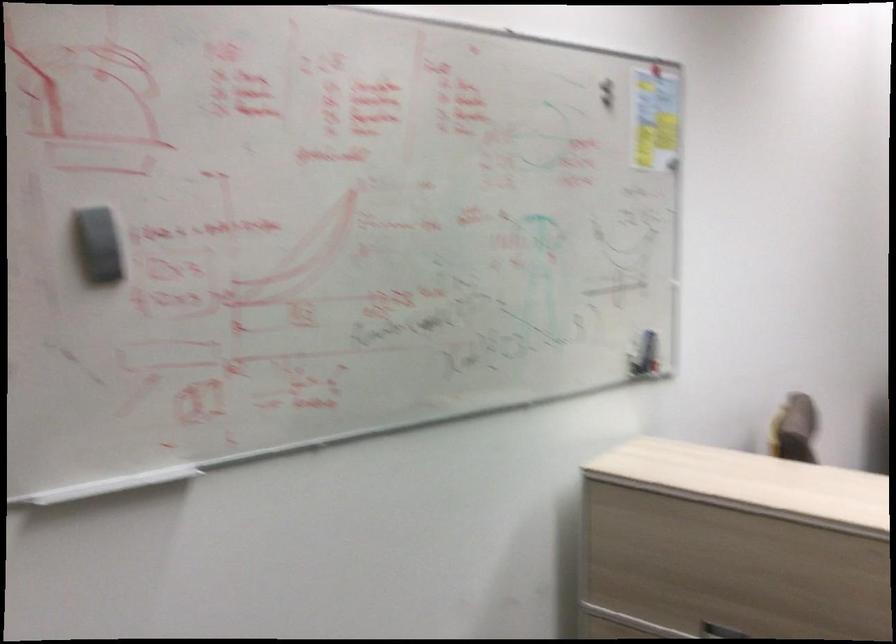
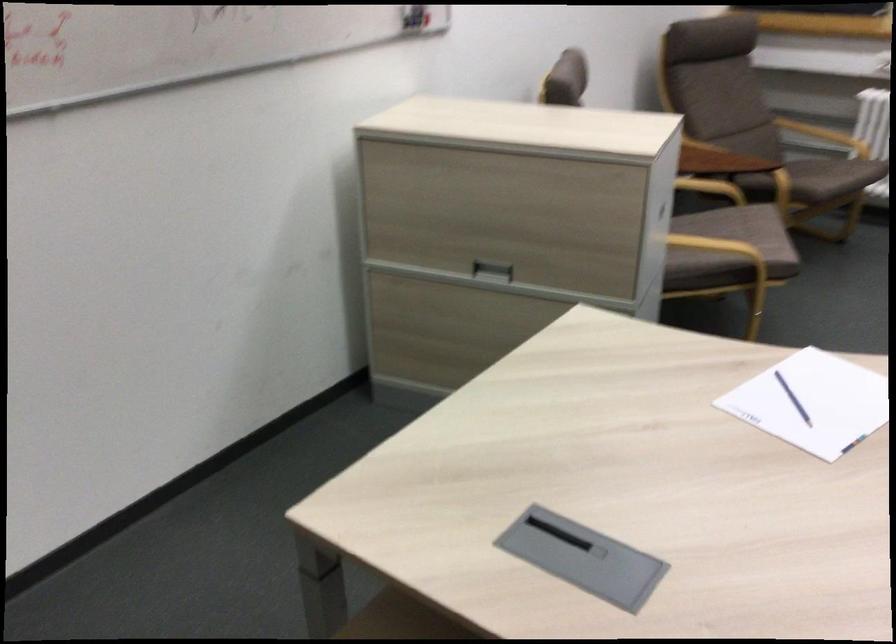
Question: How did the camera likely rotate?

Choices:
 (A) Left
 (B) Right
 (C) Up
 (D) Down

Answer: (D)